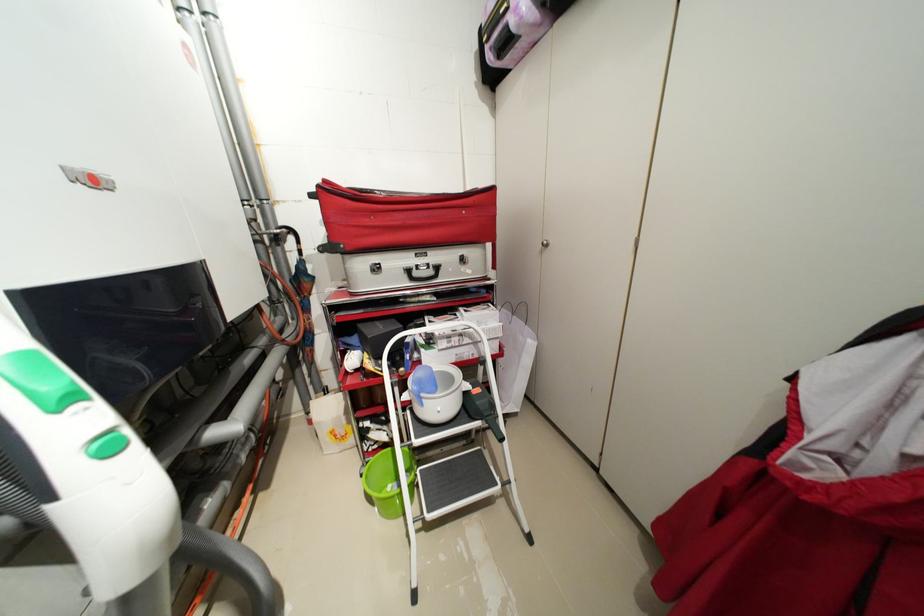
Locate an element on the screen. silver door knob is located at coordinates coord(544,244).